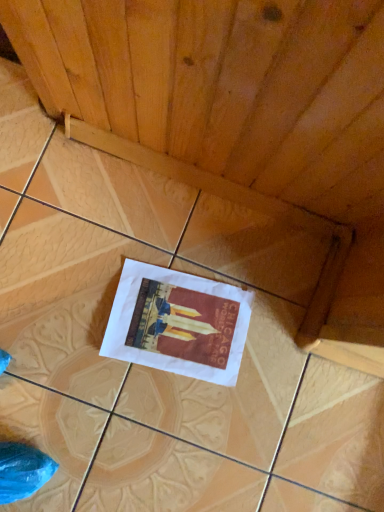
Where is `free space behind white paper poster at center`? The image size is (384, 512). free space behind white paper poster at center is located at coordinates (226, 247).